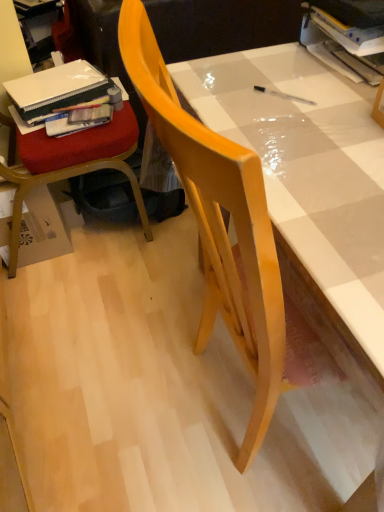
Question: Relative to wooden chair at left, which appears as the 2th chair when viewed from the right, is matte white table at center in front or behind?

Choices:
 (A) behind
 (B) front

Answer: (B)

Question: Is matte white table at center taller or shorter than wooden chair at left, the first chair viewed from the left?

Choices:
 (A) short
 (B) tall

Answer: (A)

Question: Estimate the real-world distances between objects in this image. Which object is closer to the matte plastic book at upper right, the 1th book when ordered from right to left?

Choices:
 (A) white matte book at upper left, which is the 3th book in right-to-left order
 (B) brown cardboard box at lower left
 (C) matte plastic book at left, positioned as the second book in back-to-front order
 (D) wooden chair at left, which appears as the 2th chair when viewed from the right
 (E) matte white table at center

Answer: (E)

Question: Which is farther from the brown cardboard box at lower left?

Choices:
 (A) matte white table at center
 (B) white matte book at upper left, which is counted as the first book, starting from the left
 (C) wooden chair at left, the first chair viewed from the left
 (D) matte wood chair at center, the first chair viewed from the right
 (E) matte plastic book at left, the 2th book positioned from the front

Answer: (A)